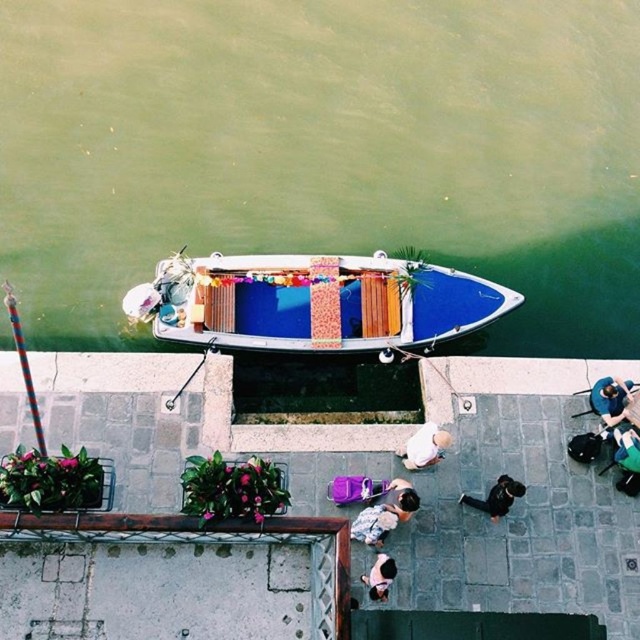
Does green water at boat top have a lesser height compared to black smooth jacket at lower center?

No, green water at boat top is not shorter than black smooth jacket at lower center.

Between green water at boat top and black smooth jacket at lower center, which one appears on the left side from the viewer's perspective?

From the viewer's perspective, green water at boat top appears more on the left side.

Between point (248, 132) and point (515, 490), which one is positioned behind?

Positioned behind is point (248, 132).

The image size is (640, 640). I want to click on green water at boat top, so click(x=324, y=150).

Which is in front, point (410, 449) or point (616, 378)?

Point (410, 449) is more forward.

Does white cotton shirt at center appear under blue fabric at lower right?

Indeed, white cotton shirt at center is positioned under blue fabric at lower right.

Between point (406, 445) and point (616, 388), which one is positioned in front?

Point (406, 445)

You are a GUI agent. You are given a task and a screenshot of the screen. Output one action in this format:
    pyautogui.click(x=<x>, y=<y>)
    Task: Click on the white cotton shirt at center
    
    Given the screenshot: What is the action you would take?
    pyautogui.click(x=422, y=445)

Between point (401, 506) and point (493, 497), which one is positioned in front?

Point (401, 506)

Is smooth beige shirt at center behind black smooth jacket at lower center?

No, it is not.

Is point (396, 518) in front of point (506, 493)?

Yes, point (396, 518) is in front of point (506, 493).

Locate an element on the screen. The width and height of the screenshot is (640, 640). smooth beige shirt at center is located at coordinates (385, 513).